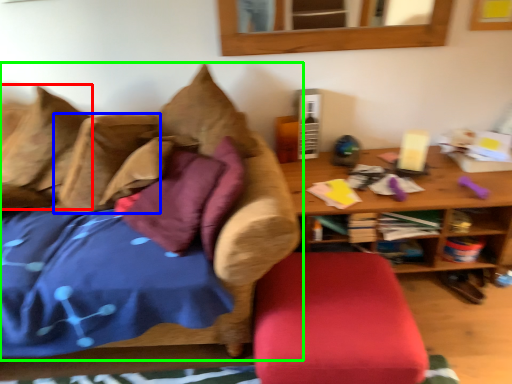
Question: Which object is positioned farthest from pillow (highlighted by a red box)? Select from pillow (highlighted by a blue box) and studio couch (highlighted by a green box).

Choices:
 (A) pillow
 (B) studio couch

Answer: (B)